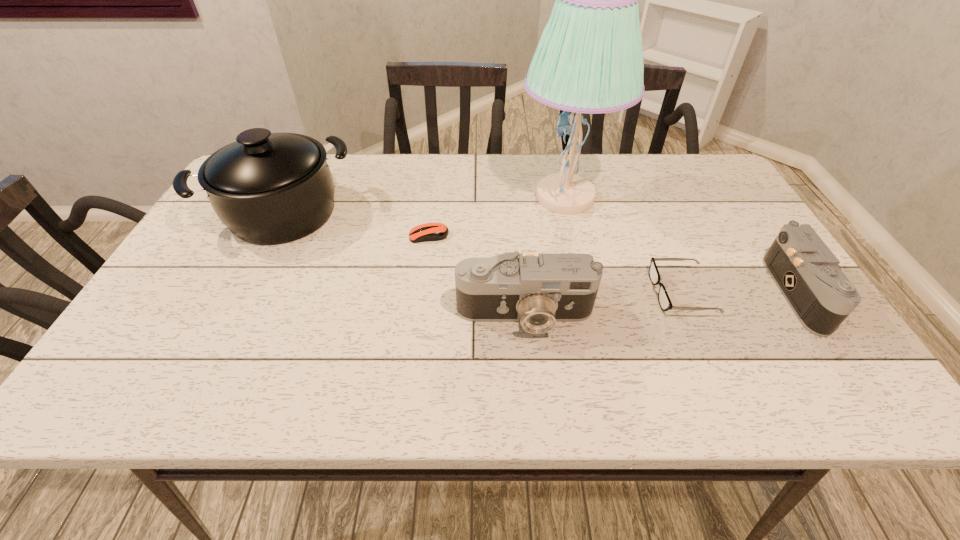
Find the location of a particular element. empty space that is in between the fifth tallest object and the taller camera is located at coordinates (603, 303).

Where is `empty space between the shortest object and the right camera`? Image resolution: width=960 pixels, height=540 pixels. empty space between the shortest object and the right camera is located at coordinates (614, 265).

At what (x,y) coordinates should I click in order to perform the action: click on object that is the fifth closest to the lamp. Please return your answer as a coordinate pair (x, y). Looking at the image, I should click on tap(268, 188).

Choose which object is the fifth nearest neighbor to the shortest object. Please provide its 2D coordinates. Your answer should be formatted as a tuple, i.e. [(x, y)], where the tuple contains the x and y coordinates of a point satisfying the conditions above.

[(808, 274)]

At what (x,y) coordinates should I click in order to perform the action: click on vacant space that satisfies the following two spatial constraints: 1. on the lens of the shorter camera; 2. on the lens of the taller camera. Please return your answer as a coordinate pair (x, y). Looking at the image, I should click on (816, 315).